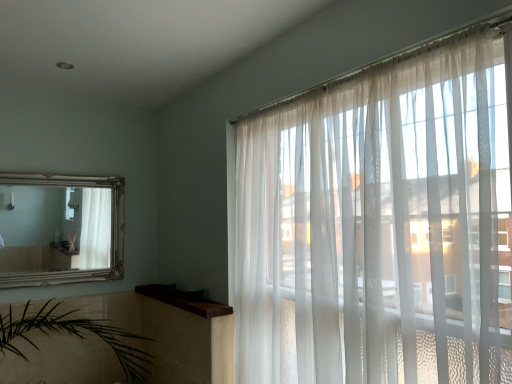
Question: Does silver/gilded mirror at upper left have a smaller size compared to brown wood at upper left?

Choices:
 (A) yes
 (B) no

Answer: (B)

Question: Is silver/gilded mirror at upper left closer to the viewer compared to brown wood at upper left?

Choices:
 (A) yes
 (B) no

Answer: (B)

Question: From a real-world perspective, does silver/gilded mirror at upper left sit lower than brown wood at upper left?

Choices:
 (A) no
 (B) yes

Answer: (A)

Question: From a real-world perspective, is silver/gilded mirror at upper left physically above brown wood at upper left?

Choices:
 (A) no
 (B) yes

Answer: (B)

Question: From the image's perspective, is silver/gilded mirror at upper left located beneath brown wood at upper left?

Choices:
 (A) no
 (B) yes

Answer: (A)

Question: From the image's perspective, is brown wood at upper left above or below translucent white curtains at right?

Choices:
 (A) below
 (B) above

Answer: (A)

Question: Looking at the image, does brown wood at upper left seem bigger or smaller compared to translucent white curtains at right?

Choices:
 (A) big
 (B) small

Answer: (B)

Question: In the image, is brown wood at upper left positioned in front of or behind translucent white curtains at right?

Choices:
 (A) behind
 (B) front

Answer: (A)

Question: In the image, is brown wood at upper left on the left side or the right side of translucent white curtains at right?

Choices:
 (A) left
 (B) right

Answer: (A)

Question: Is silver/gilded mirror at upper left in front of or behind brown wood at upper left in the image?

Choices:
 (A) behind
 (B) front

Answer: (A)

Question: Is point (8, 195) closer or farther from the camera than point (178, 299)?

Choices:
 (A) closer
 (B) farther

Answer: (B)

Question: From a real-world perspective, is silver/gilded mirror at upper left positioned above or below brown wood at upper left?

Choices:
 (A) below
 (B) above

Answer: (B)

Question: Is silver/gilded mirror at upper left taller or shorter than brown wood at upper left?

Choices:
 (A) short
 (B) tall

Answer: (B)

Question: Considering the positions of point (25, 249) and point (239, 269), is point (25, 249) closer or farther from the camera than point (239, 269)?

Choices:
 (A) closer
 (B) farther

Answer: (B)

Question: From the image's perspective, is silver/gilded mirror at upper left located above or below translucent white curtains at right?

Choices:
 (A) above
 (B) below

Answer: (A)